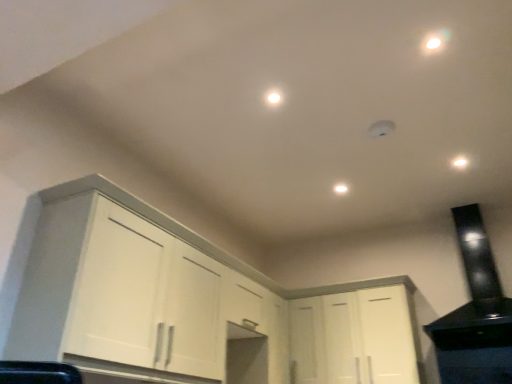
Question: Is white matte light fixture at center, arranged as the 2th dot when viewed from the front, at the right side of black glossy range hood at upper right?

Choices:
 (A) yes
 (B) no

Answer: (B)

Question: Considering the relative sizes of white matte light fixture at center, which ranks as the 2th dot in top-to-bottom order, and black glossy range hood at upper right in the image provided, is white matte light fixture at center, which ranks as the 2th dot in top-to-bottom order, wider than black glossy range hood at upper right?

Choices:
 (A) yes
 (B) no

Answer: (B)

Question: Does white matte light fixture at center, the 1th dot in the right-to-left sequence, have a smaller size compared to black glossy range hood at upper right?

Choices:
 (A) no
 (B) yes

Answer: (B)

Question: Is white matte light fixture at center, the 2th dot when ordered from left to right, thinner than black glossy range hood at upper right?

Choices:
 (A) yes
 (B) no

Answer: (A)

Question: Is white matte light fixture at center, arranged as the 2th dot when viewed from the front, bigger than black glossy range hood at upper right?

Choices:
 (A) no
 (B) yes

Answer: (A)

Question: From a real-world perspective, is white matte light fixture at center, acting as the 1th dot starting from the back, located beneath black glossy range hood at upper right?

Choices:
 (A) no
 (B) yes

Answer: (A)

Question: Does white matte cabinet at center, which is counted as the second cabinetry, starting from the left, come behind black glossy range hood at upper right?

Choices:
 (A) no
 (B) yes

Answer: (B)

Question: Is white matte cabinet at center, acting as the 1th cabinetry starting from the right, facing away from black glossy range hood at upper right?

Choices:
 (A) no
 (B) yes

Answer: (A)

Question: From the image's perspective, is white matte cabinet at center, acting as the 1th cabinetry starting from the right, on black glossy range hood at upper right?

Choices:
 (A) yes
 (B) no

Answer: (B)

Question: Is white matte cabinet at center, acting as the 1th cabinetry starting from the right, oriented towards black glossy range hood at upper right?

Choices:
 (A) no
 (B) yes

Answer: (A)

Question: Is white matte cabinet at center, which is counted as the second cabinetry, starting from the left, not inside black glossy range hood at upper right?

Choices:
 (A) yes
 (B) no

Answer: (A)

Question: Considering the relative sizes of white matte cabinet at center, which is counted as the second cabinetry, starting from the left, and black glossy range hood at upper right in the image provided, is white matte cabinet at center, which is counted as the second cabinetry, starting from the left, shorter than black glossy range hood at upper right?

Choices:
 (A) no
 (B) yes

Answer: (B)

Question: Is white matte cabinet at center, which is counted as the second cabinetry, starting from the left, not within white matte light fixture at center, the 1th dot in the right-to-left sequence?

Choices:
 (A) yes
 (B) no

Answer: (A)